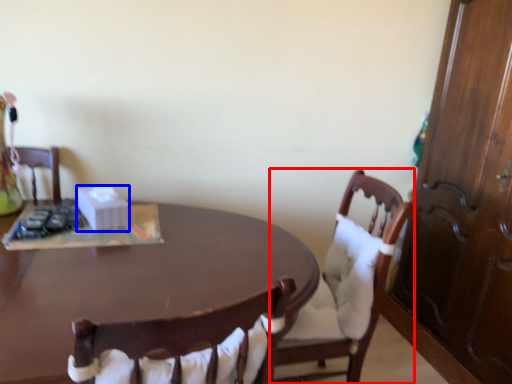
Question: Which of the following is the farthest to the observer, chair (highlighted by a red box) or box (highlighted by a blue box)?

Choices:
 (A) chair
 (B) box

Answer: (B)